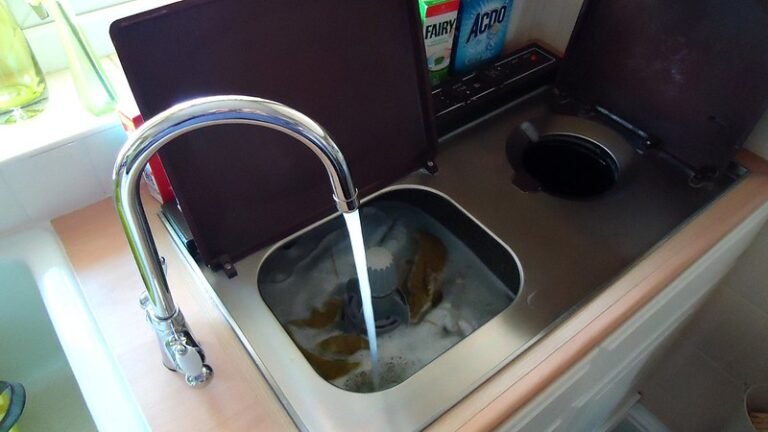
Identify the location of counter. The width and height of the screenshot is (768, 432). (81, 264).